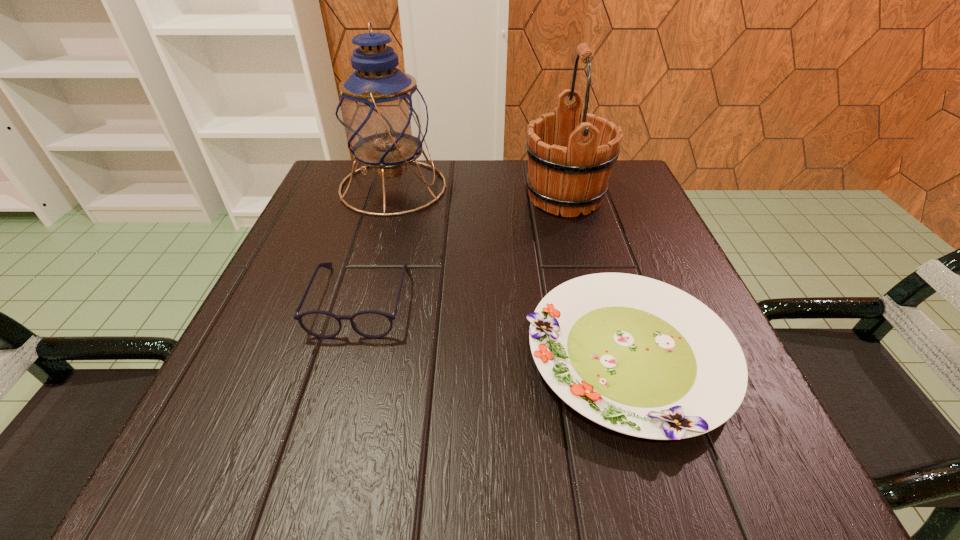
What are the coordinates of `object at the near edge` in the screenshot? It's located at (636, 355).

Where is `lantern that is positioned at the left edge`? The width and height of the screenshot is (960, 540). lantern that is positioned at the left edge is located at coordinates (381, 114).

This screenshot has width=960, height=540. I want to click on spectacles located in the left edge section of the desktop, so click(x=373, y=324).

Locate an element on the screen. This screenshot has width=960, height=540. wine bucket situated at the right edge is located at coordinates (569, 162).

Locate an element on the screen. salad plate positioned at the right edge is located at coordinates (636, 355).

The image size is (960, 540). In order to click on object that is at the far left corner in this screenshot , I will do `click(381, 114)`.

Identify the location of object located at the far right corner. (569, 162).

Where is `object positioned at the near right corner`? The height and width of the screenshot is (540, 960). object positioned at the near right corner is located at coordinates (636, 355).

This screenshot has width=960, height=540. Identify the location of vacant region at the far edge of the desktop. (424, 214).

The image size is (960, 540). In the image, there is a desktop. Find the location of `blank space at the near edge`. blank space at the near edge is located at coordinates (564, 442).